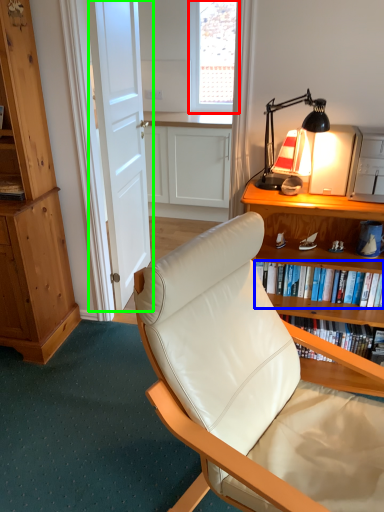
Question: Which object is the farthest from window screen (highlighted by a red box)? Choose among these: book (highlighted by a blue box) or door (highlighted by a green box).

Choices:
 (A) book
 (B) door

Answer: (A)